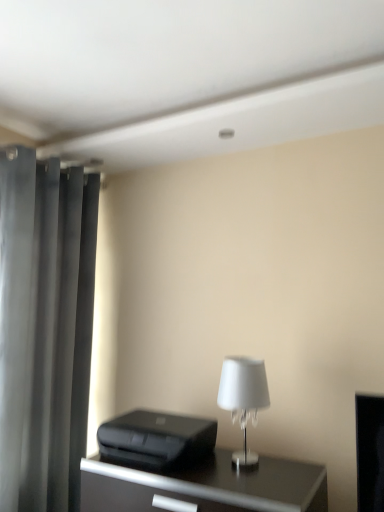
Question: Is dark gray matte curtain at left at the left side of black plastic printer at lower center?

Choices:
 (A) yes
 (B) no

Answer: (A)

Question: Does dark gray matte curtain at left lie in front of black plastic printer at lower center?

Choices:
 (A) yes
 (B) no

Answer: (B)

Question: Considering the relative sizes of dark gray matte curtain at left and black plastic printer at lower center in the image provided, is dark gray matte curtain at left thinner than black plastic printer at lower center?

Choices:
 (A) no
 (B) yes

Answer: (B)

Question: Does dark gray matte curtain at left turn towards black plastic printer at lower center?

Choices:
 (A) yes
 (B) no

Answer: (A)

Question: Is dark gray matte curtain at left far from black plastic printer at lower center?

Choices:
 (A) no
 (B) yes

Answer: (A)

Question: From a real-world perspective, is black glossy table at center physically located above or below black plastic printer at lower center?

Choices:
 (A) below
 (B) above

Answer: (A)

Question: Looking at the image, does black glossy table at center seem bigger or smaller compared to black plastic printer at lower center?

Choices:
 (A) big
 (B) small

Answer: (A)

Question: In terms of width, does black glossy table at center look wider or thinner when compared to black plastic printer at lower center?

Choices:
 (A) wide
 (B) thin

Answer: (A)

Question: Is point (211, 486) positioned closer to the camera than point (193, 436)?

Choices:
 (A) farther
 (B) closer

Answer: (B)

Question: Which is correct: white glass lamp at center is inside black plastic printer at lower center, or outside of it?

Choices:
 (A) inside
 (B) outside

Answer: (B)

Question: Is point (233, 402) positioned closer to the camera than point (190, 420)?

Choices:
 (A) farther
 (B) closer

Answer: (B)

Question: In the image, is white glass lamp at center on the left side or the right side of black plastic printer at lower center?

Choices:
 (A) left
 (B) right

Answer: (B)

Question: Based on their sizes in the image, would you say white glass lamp at center is bigger or smaller than black plastic printer at lower center?

Choices:
 (A) big
 (B) small

Answer: (B)

Question: From a real-world perspective, is white glass lamp at center positioned above or below dark gray matte curtain at left?

Choices:
 (A) above
 (B) below

Answer: (B)

Question: Considering the relative positions of white glass lamp at center and dark gray matte curtain at left in the image provided, is white glass lamp at center to the left or to the right of dark gray matte curtain at left?

Choices:
 (A) left
 (B) right

Answer: (B)